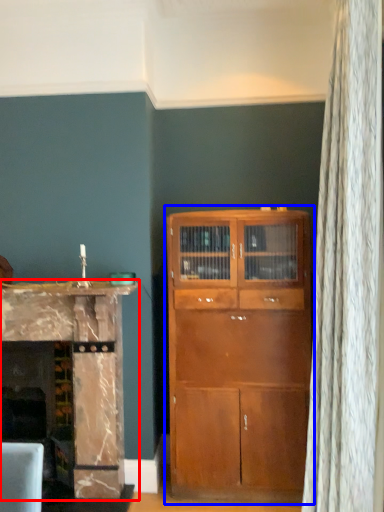
Question: Which point is further to the camera, cabinetry (highlighted by a red box) or cupboard (highlighted by a blue box)?

Choices:
 (A) cabinetry
 (B) cupboard

Answer: (B)